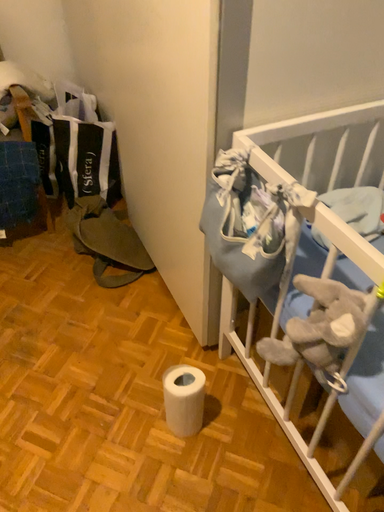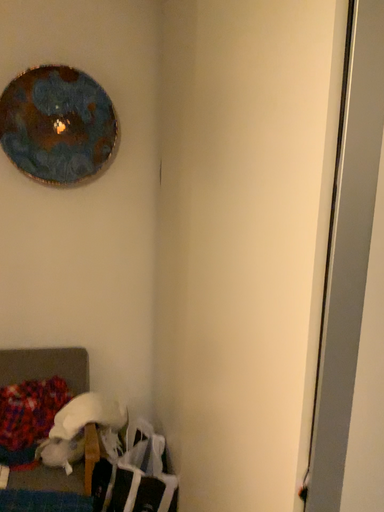
Question: Which way did the camera rotate in the video?

Choices:
 (A) rotated downward
 (B) rotated upward

Answer: (B)